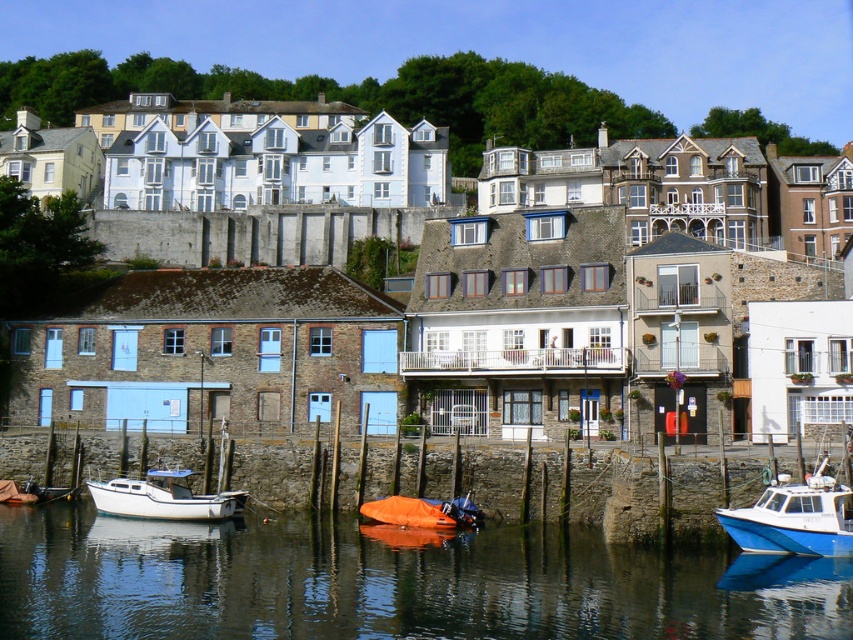
Does point (172, 484) come farther from viewer compared to point (395, 506)?

Yes.

Can you confirm if white matte boat at lower left is wider than orange tarpaulin boat at lower center?

No.

Measure the distance between white matte boat at lower left and camera.

185.16 feet

Find the location of a particular element. white matte boat at lower left is located at coordinates (161, 497).

Does transparent water at lower center appear on the right side of white matte boat at lower left?

Yes, transparent water at lower center is to the right of white matte boat at lower left.

Between point (227, 600) and point (155, 508), which one is positioned in front?

Positioned in front is point (227, 600).

I want to click on transparent water at lower center, so click(389, 582).

Does blue glossy boat at lower right have a lesser width compared to white matte boat at lower left?

Incorrect, blue glossy boat at lower right's width is not less than white matte boat at lower left's.

Which is more to the right, blue glossy boat at lower right or white matte boat at lower left?

From the viewer's perspective, blue glossy boat at lower right appears more on the right side.

What are the coordinates of `blue glossy boat at lower right` in the screenshot? It's located at (795, 516).

What are the coordinates of `blue glossy boat at lower right` in the screenshot? It's located at (795, 516).